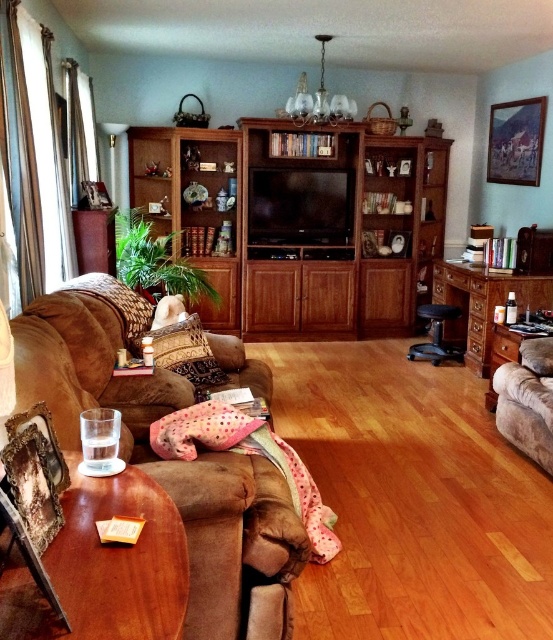
Does wooden entertainment center at center have a lesser width compared to suede armchair at right?

In fact, wooden entertainment center at center might be wider than suede armchair at right.

I want to click on wooden entertainment center at center, so click(x=302, y=225).

Describe the element at coordinates (302, 225) in the screenshot. The width and height of the screenshot is (553, 640). I see `wooden entertainment center at center` at that location.

You are a GUI agent. You are given a task and a screenshot of the screen. Output one action in this format:
    pyautogui.click(x=<x>, y=<y>)
    Task: Click on the wooden entertainment center at center
    This screenshot has width=553, height=640.
    Given the screenshot: What is the action you would take?
    pyautogui.click(x=302, y=225)

Can you confirm if suede armchair at right is wider than black leather stool at center?

Incorrect, suede armchair at right's width does not surpass black leather stool at center's.

Does suede armchair at right have a greater height compared to black leather stool at center?

Indeed, suede armchair at right has a greater height compared to black leather stool at center.

Is point (526, 426) positioned behind point (420, 352)?

No.

Identify the location of suede armchair at right. (526, 401).

From the picture: Does brown textured pillow at center appear on the left side of black leather stool at center?

Indeed, brown textured pillow at center is positioned on the left side of black leather stool at center.

Locate an element on the screen. The width and height of the screenshot is (553, 640). brown textured pillow at center is located at coordinates point(185,353).

Between point (192, 330) and point (447, 356), which one is positioned in front?

Point (192, 330)

Where is `brown textured pillow at center`? Image resolution: width=553 pixels, height=640 pixels. brown textured pillow at center is located at coordinates (185, 353).